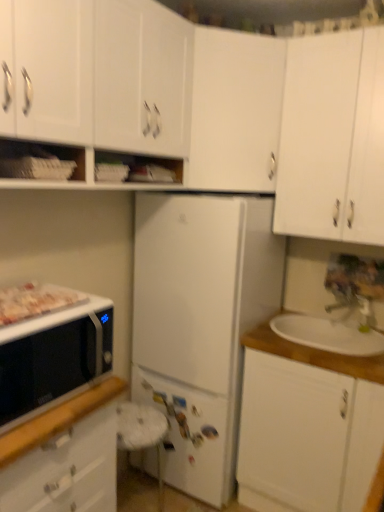
Locate an element on the screen. The image size is (384, 512). white wood sink at right is located at coordinates (314, 355).

Describe the element at coordinates (306, 436) in the screenshot. I see `white wood cabinet at right, placed as the fourth cabinetry when sorted from left to right` at that location.

Measure the distance between point [195,44] and camera.

The distance of point [195,44] from camera is 1.90 meters.

What are the coordinates of `white wood sink at right` in the screenshot? It's located at (314, 355).

Considering the positions of objects white matte microwave at lower left, the 5th cabinetry when ordered from right to left, and white wood sink at right in the image provided, who is more to the right, white matte microwave at lower left, the 5th cabinetry when ordered from right to left, or white wood sink at right?

white wood sink at right.

Between white matte microwave at lower left, the 5th cabinetry when ordered from right to left, and white wood sink at right, which one has more height?

white matte microwave at lower left, the 5th cabinetry when ordered from right to left.

Does white matte microwave at lower left, the 1th cabinetry positioned from the left, lie behind white wood sink at right?

No, it is not.

Between point (91, 408) and point (277, 341), which one is positioned behind?

Positioned behind is point (277, 341).

Which of these two, black matte microwave at left or white matte microwave at lower left, the 1th cabinetry positioned from the left, is smaller?

With smaller size is black matte microwave at left.

Could you tell me if black matte microwave at left is turned towards white matte microwave at lower left, the 5th cabinetry when ordered from right to left?

No, black matte microwave at left is not turned towards white matte microwave at lower left, the 5th cabinetry when ordered from right to left.

Looking at this image, considering the sizes of objects black matte microwave at left and white matte microwave at lower left, the 1th cabinetry positioned from the left, in the image provided, who is taller, black matte microwave at left or white matte microwave at lower left, the 1th cabinetry positioned from the left,?

white matte microwave at lower left, the 1th cabinetry positioned from the left.

Would you say black matte microwave at left is to the left or to the right of white matte cabinet at upper left, which is the 4th cabinetry from right to left, in the picture?

black matte microwave at left is positioned on white matte cabinet at upper left, which is the 4th cabinetry from right to left,'s left side.

In the image, is black matte microwave at left positioned in front of or behind white matte cabinet at upper left, arranged as the second cabinetry when viewed from the left?

black matte microwave at left is behind white matte cabinet at upper left, arranged as the second cabinetry when viewed from the left.

From a real-world perspective, between black matte microwave at left and white matte cabinet at upper left, arranged as the second cabinetry when viewed from the left, who is vertically higher?

white matte cabinet at upper left, arranged as the second cabinetry when viewed from the left, from a real-world perspective.

Which is in front, point (31, 332) or point (173, 103)?

Positioned in front is point (31, 332).

Which of these two, white matte cabinet at upper left, arranged as the second cabinetry when viewed from the left, or white matte microwave at lower left, the 5th cabinetry when ordered from right to left, stands shorter?

Standing shorter between the two is white matte cabinet at upper left, arranged as the second cabinetry when viewed from the left.

Does point (56, 60) appear closer or farther from the camera than point (78, 467)?

Point (56, 60) appears to be closer to the viewer than point (78, 467).

Is white matte cabinet at upper left, which is the 4th cabinetry from right to left, outside of white matte microwave at lower left, the 5th cabinetry when ordered from right to left?

Yes, white matte cabinet at upper left, which is the 4th cabinetry from right to left, is not within white matte microwave at lower left, the 5th cabinetry when ordered from right to left.

Which object is closer to the camera taking this photo, white matte cabinet at upper left, which is the 4th cabinetry from right to left, or white matte microwave at lower left, the 1th cabinetry positioned from the left?

white matte cabinet at upper left, which is the 4th cabinetry from right to left, is more forward.

Looking at the image, does white matte cabinet at upper right, marked as the 1th cabinetry in a right-to-left arrangement, seem bigger or smaller compared to metallic silver faucet at upper right?

In the image, white matte cabinet at upper right, marked as the 1th cabinetry in a right-to-left arrangement, appears to be larger than metallic silver faucet at upper right.

Identify the location of faucet beneath the white matte cabinet at upper right, which is the 5th cabinetry from left to right (from a real-world perspective). (354, 305).

Is metallic silver faucet at upper right at the back of white matte cabinet at upper right, marked as the 1th cabinetry in a right-to-left arrangement?

That's not correct — white matte cabinet at upper right, marked as the 1th cabinetry in a right-to-left arrangement, is not looking away from metallic silver faucet at upper right.

Which object is wider, white matte cabinet at upper right, which is the 5th cabinetry from left to right, or metallic silver faucet at upper right?

white matte cabinet at upper right, which is the 5th cabinetry from left to right, is wider.

Is point (200, 291) positioned after point (10, 297)?

Yes.

From a real-world perspective, is white matte refrigerator at center beneath white glossy tray at left?

Yes, from a real-world perspective, white matte refrigerator at center is below white glossy tray at left.

Is white matte refrigerator at center beside white glossy tray at left?

white matte refrigerator at center and white glossy tray at left are clearly separated.

Based on the photo, how much distance is there between white matte refrigerator at center and white glossy tray at left?

white matte refrigerator at center is 32.95 inches away from white glossy tray at left.

Can you confirm if white matte microwave at lower left, the 5th cabinetry when ordered from right to left, is positioned to the right of white matte cabinet at upper center, which is the 3th cabinetry in left-to-right order?

No, white matte microwave at lower left, the 5th cabinetry when ordered from right to left, is not to the right of white matte cabinet at upper center, which is the 3th cabinetry in left-to-right order.

Considering the sizes of objects white matte microwave at lower left, the 5th cabinetry when ordered from right to left, and white matte cabinet at upper center, marked as the third cabinetry in a right-to-left arrangement, in the image provided, who is thinner, white matte microwave at lower left, the 5th cabinetry when ordered from right to left, or white matte cabinet at upper center, marked as the third cabinetry in a right-to-left arrangement,?

Thinner between the two is white matte cabinet at upper center, marked as the third cabinetry in a right-to-left arrangement.

At what (x,y) coordinates should I click in order to perform the action: click on cabinetry that is the 2nd object to the right of the white matte microwave at lower left, the 5th cabinetry when ordered from right to left, starting at the anchor. Please return your answer as a coordinate pair (x, y). The height and width of the screenshot is (512, 384). Looking at the image, I should click on (235, 111).

How many degrees apart are the facing directions of white matte microwave at lower left, the 1th cabinetry positioned from the left, and white matte cabinet at upper center, marked as the third cabinetry in a right-to-left arrangement?

133 degrees.

I want to click on countertop above the white matte microwave at lower left, the 5th cabinetry when ordered from right to left (from a real-world perspective), so click(314, 355).

You are a GUI agent. You are given a task and a screenshot of the screen. Output one action in this format:
    pyautogui.click(x=<x>, y=<y>)
    Task: Click on the microwave oven in front of the white matte microwave at lower left, the 5th cabinetry when ordered from right to left
    The image size is (384, 512).
    Given the screenshot: What is the action you would take?
    pyautogui.click(x=53, y=358)

Based on their spatial positions, is white glossy tray at left or metallic silver faucet at upper right closer to black matte microwave at left?

Among the two, white glossy tray at left is located nearer to black matte microwave at left.

From the image, which object appears to be nearer to white matte refrigerator at center, metallic silver faucet at upper right or white matte cabinet at upper left, which is the 4th cabinetry from right to left?

white matte cabinet at upper left, which is the 4th cabinetry from right to left, lies closer to white matte refrigerator at center than the other object.

From the image, which object appears to be farther from white matte microwave at lower left, the 1th cabinetry positioned from the left, white wood sink at right or white glossy tray at left?

white wood sink at right is further to white matte microwave at lower left, the 1th cabinetry positioned from the left.

Estimate the real-world distances between objects in this image. Which object is closer to white matte cabinet at upper left, arranged as the second cabinetry when viewed from the left, white glossy tray at left or white matte cabinet at upper right, marked as the 1th cabinetry in a right-to-left arrangement?

white glossy tray at left lies closer to white matte cabinet at upper left, arranged as the second cabinetry when viewed from the left, than the other object.

From the image, which object appears to be nearer to white glossy tray at left, white wood sink at right or white matte microwave at lower left, the 1th cabinetry positioned from the left?

The object closer to white glossy tray at left is white matte microwave at lower left, the 1th cabinetry positioned from the left.

Considering their positions, is white wood cabinet at right, placed as the fourth cabinetry when sorted from left to right, positioned further to white matte cabinet at upper left, which is the 4th cabinetry from right to left, than white wood sink at right?

Among the two, white wood cabinet at right, placed as the fourth cabinetry when sorted from left to right, is located further to white matte cabinet at upper left, which is the 4th cabinetry from right to left.

From the image, which object appears to be farther from white wood sink at right, metallic silver faucet at upper right or white glossy tray at left?

white glossy tray at left lies further to white wood sink at right than the other object.

Considering their positions, is white wood sink at right positioned closer to white wood cabinet at right, placed as the fourth cabinetry when sorted from left to right, than metallic silver faucet at upper right?

white wood sink at right.

The image size is (384, 512). I want to click on refrigerator between black matte microwave at left and white wood cabinet at right, placed as the fourth cabinetry when sorted from left to right, so click(x=200, y=323).

Where is `countertop that lies between white matte cabinet at upper left, which is the 4th cabinetry from right to left, and white matte refrigerator at center from top to bottom`? countertop that lies between white matte cabinet at upper left, which is the 4th cabinetry from right to left, and white matte refrigerator at center from top to bottom is located at coordinates pos(314,355).

Where is `faucet between white matte cabinet at upper center, which is the 3th cabinetry in left-to-right order, and white matte refrigerator at center in the up-down direction`? faucet between white matte cabinet at upper center, which is the 3th cabinetry in left-to-right order, and white matte refrigerator at center in the up-down direction is located at coordinates (354, 305).

Locate an element on the screen. This screenshot has width=384, height=512. refrigerator that lies between white matte cabinet at upper center, which is the 3th cabinetry in left-to-right order, and white matte microwave at lower left, the 1th cabinetry positioned from the left, from top to bottom is located at coordinates (200, 323).